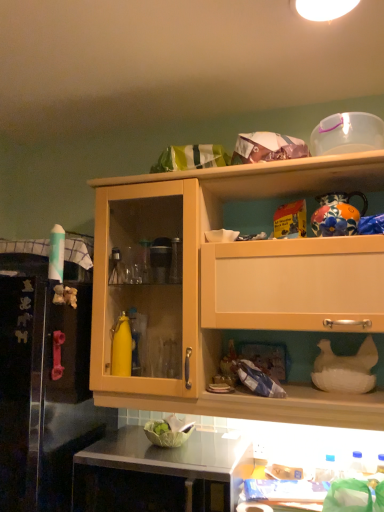
Question: Is rubber pink handle at left a part of wooden cabinet at upper center?

Choices:
 (A) no
 (B) yes

Answer: (A)

Question: Is wooden cabinet at upper center bigger than rubber pink handle at left?

Choices:
 (A) yes
 (B) no

Answer: (B)

Question: Is the position of wooden cabinet at upper center more distant than that of rubber pink handle at left?

Choices:
 (A) no
 (B) yes

Answer: (B)

Question: Considering the relative positions of wooden cabinet at upper center and rubber pink handle at left in the image provided, is wooden cabinet at upper center to the left of rubber pink handle at left from the viewer's perspective?

Choices:
 (A) yes
 (B) no

Answer: (B)

Question: Is wooden cabinet at upper center smaller than rubber pink handle at left?

Choices:
 (A) no
 (B) yes

Answer: (B)

Question: From a real-world perspective, is wooden cabinet at upper center physically located above or below transparent plastic container at upper right, which is counted as the 1th appliance, starting from the top?

Choices:
 (A) above
 (B) below

Answer: (B)

Question: Relative to transparent plastic container at upper right, which is counted as the 1th appliance, starting from the top, is wooden cabinet at upper center in front or behind?

Choices:
 (A) front
 (B) behind

Answer: (A)

Question: Visually, is wooden cabinet at upper center positioned to the left or to the right of transparent plastic container at upper right, which is counted as the 1th appliance, starting from the top?

Choices:
 (A) left
 (B) right

Answer: (A)

Question: From the image's perspective, relative to transparent plastic container at upper right, which appears as the second appliance when ordered from the bottom, is wooden cabinet at upper center above or below?

Choices:
 (A) below
 (B) above

Answer: (A)

Question: Looking at the image, does white matte chicken at lower right, the second appliance when ordered from top to bottom, seem bigger or smaller compared to black glossy countertop at lower center?

Choices:
 (A) big
 (B) small

Answer: (B)

Question: Does point (369, 338) appear closer or farther from the camera than point (193, 434)?

Choices:
 (A) closer
 (B) farther

Answer: (A)

Question: From the image's perspective, relative to black glossy countertop at lower center, is white matte chicken at lower right, the second appliance when ordered from top to bottom, above or below?

Choices:
 (A) above
 (B) below

Answer: (A)

Question: From a real-world perspective, is white matte chicken at lower right, the second appliance when ordered from top to bottom, above or below black glossy countertop at lower center?

Choices:
 (A) above
 (B) below

Answer: (A)

Question: Looking at the image, does white matte chicken at lower right, the second appliance when ordered from top to bottom, seem bigger or smaller compared to rubber pink handle at left?

Choices:
 (A) big
 (B) small

Answer: (B)

Question: Would you say white matte chicken at lower right, the second appliance when ordered from top to bottom, is to the left or to the right of rubber pink handle at left in the picture?

Choices:
 (A) right
 (B) left

Answer: (A)